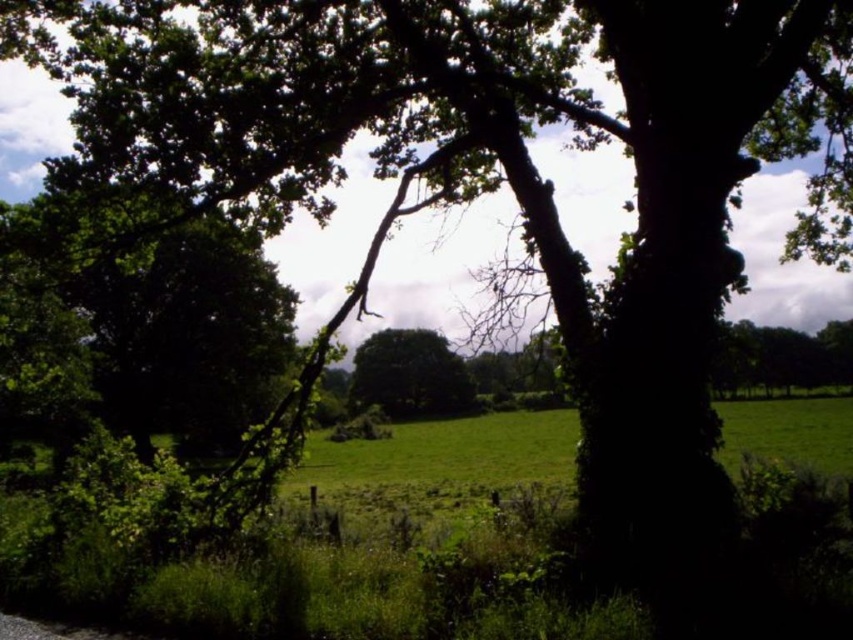
Can you confirm if green leafy tree at left is smaller than green leafy tree at center?

Incorrect, green leafy tree at left is not smaller in size than green leafy tree at center.

Is point (109, 296) closer to viewer compared to point (368, 362)?

Yes, it is.

Which is behind, point (122, 385) or point (445, 344)?

The point (445, 344) is behind.

Find the location of a particular element. The height and width of the screenshot is (640, 853). green leafy tree at left is located at coordinates (163, 310).